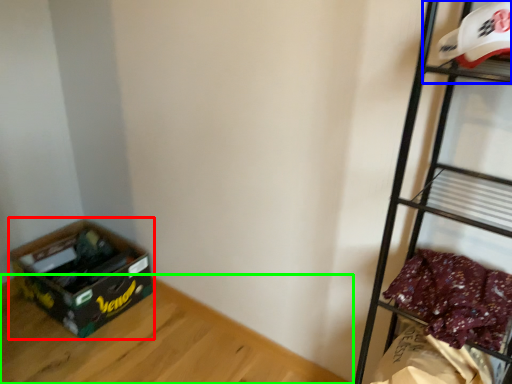
Question: Which object is the farthest from storage box (highlighted by a red box)? Choose among these: shelf (highlighted by a blue box) or furniture (highlighted by a green box).

Choices:
 (A) shelf
 (B) furniture

Answer: (A)